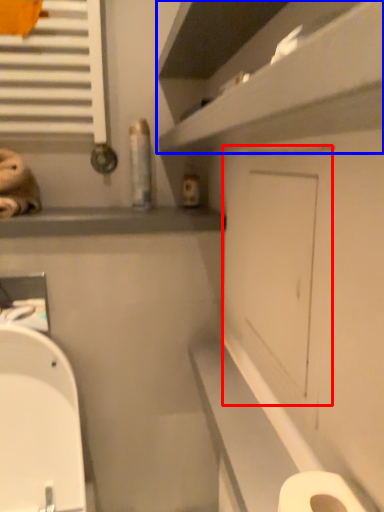
Question: Which of the following is the closest to the observer, screen door (highlighted by a red box) or shelf (highlighted by a blue box)?

Choices:
 (A) screen door
 (B) shelf

Answer: (B)